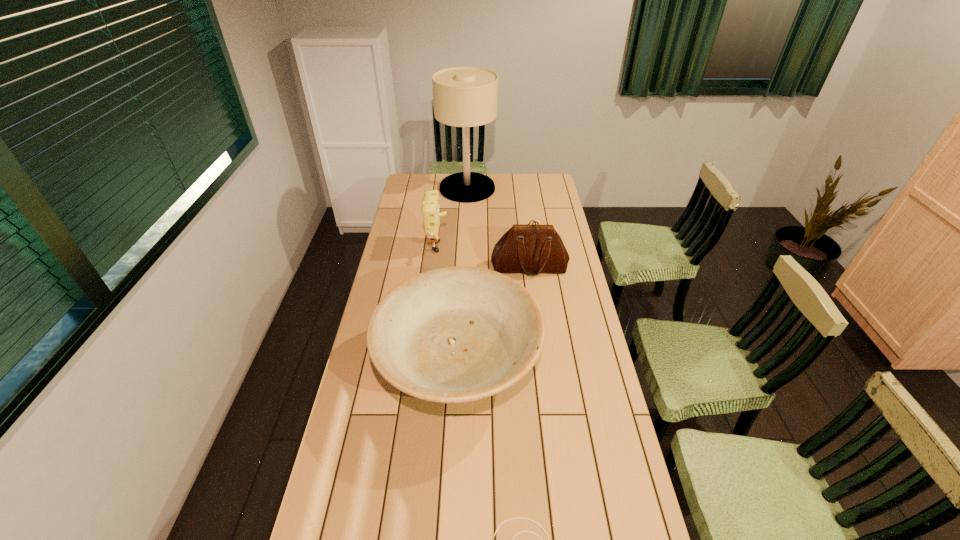
The width and height of the screenshot is (960, 540). In order to click on empty location between the shoulder bag and the sponge in this screenshot , I will do [x=484, y=258].

Locate an element on the screen. object that is the third closest to the dish is located at coordinates (430, 209).

You are a GUI agent. You are given a task and a screenshot of the screen. Output one action in this format:
    pyautogui.click(x=<x>, y=<y>)
    Task: Click on the fourth closest object to the tallest object
    This screenshot has height=540, width=960.
    Given the screenshot: What is the action you would take?
    pyautogui.click(x=516, y=517)

At what (x,y) coordinates should I click in order to perform the action: click on free space that satisfies the following two spatial constraints: 1. on the face of the sponge; 2. on the right side of the dish. Please return your answer as a coordinate pair (x, y). The width and height of the screenshot is (960, 540). Looking at the image, I should click on click(x=423, y=368).

This screenshot has width=960, height=540. What are the coordinates of `free space that satisfies the following two spatial constraints: 1. on the back side of the shoulder bag; 2. on the face of the sponge` in the screenshot? It's located at (527, 250).